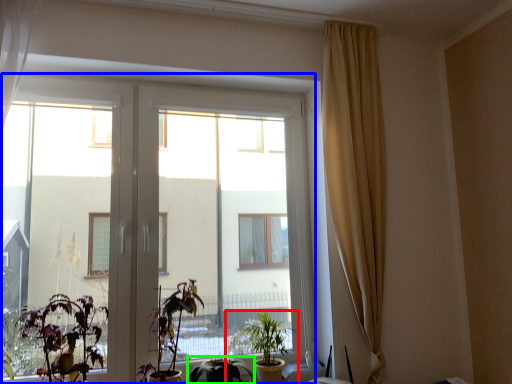
Question: Which is nearer to the houseplant (highlighted by a red box)? window (highlighted by a blue box) or houseplant (highlighted by a green box).

Choices:
 (A) window
 (B) houseplant

Answer: (B)